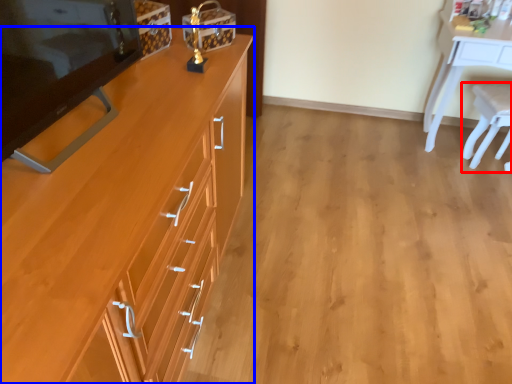
Question: Among these objects, which one is farthest to the camera, chair (highlighted by a red box) or cabinetry (highlighted by a blue box)?

Choices:
 (A) chair
 (B) cabinetry

Answer: (A)